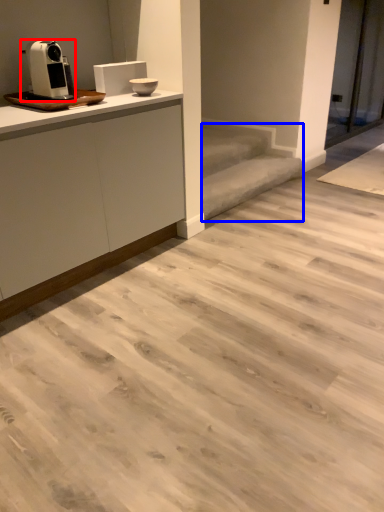
Question: Which of the following is the farthest to the observer, home appliance (highlighted by a red box) or stair (highlighted by a blue box)?

Choices:
 (A) home appliance
 (B) stair

Answer: (B)